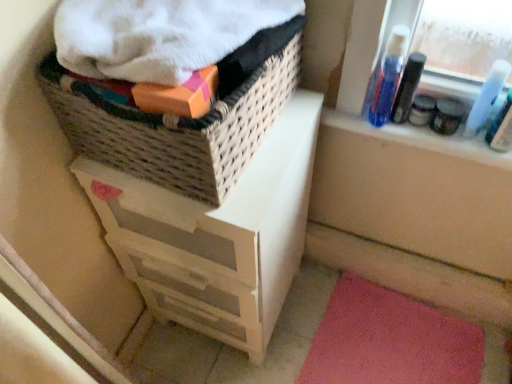
I want to click on blank space situated above pink carpet at lower right (from a real-world perspective), so click(x=381, y=343).